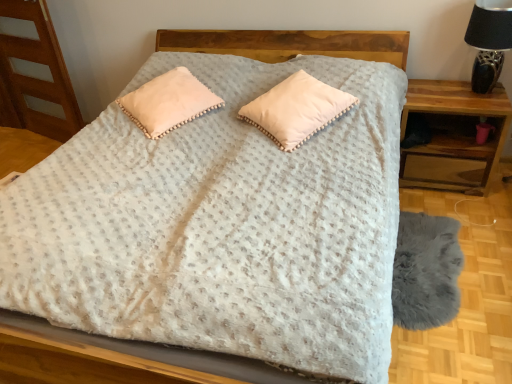
Question: Should I look upward or downward to see pom-pom trim pillow at center, arranged as the second pillow when viewed from the left?

Choices:
 (A) up
 (B) down

Answer: (A)

Question: Which direction should I rotate to look at peach velvety pillow at center, positioned as the 1th pillow in left-to-right order, — up or down?

Choices:
 (A) up
 (B) down

Answer: (A)

Question: From the image's perspective, does black ceramic table lamp at upper right appear lower than pom-pom trim pillow at center, acting as the first pillow starting from the right?

Choices:
 (A) no
 (B) yes

Answer: (A)

Question: Does black ceramic table lamp at upper right come behind pom-pom trim pillow at center, arranged as the second pillow when viewed from the left?

Choices:
 (A) no
 (B) yes

Answer: (B)

Question: Is black ceramic table lamp at upper right wider than pom-pom trim pillow at center, arranged as the second pillow when viewed from the left?

Choices:
 (A) yes
 (B) no

Answer: (B)

Question: Does black ceramic table lamp at upper right have a smaller size compared to pom-pom trim pillow at center, acting as the first pillow starting from the right?

Choices:
 (A) no
 (B) yes

Answer: (B)

Question: Is black ceramic table lamp at upper right positioned in front of pom-pom trim pillow at center, acting as the first pillow starting from the right?

Choices:
 (A) yes
 (B) no

Answer: (B)

Question: Are black ceramic table lamp at upper right and pom-pom trim pillow at center, acting as the first pillow starting from the right, far apart?

Choices:
 (A) no
 (B) yes

Answer: (A)

Question: Is wooden nightstand at right facing towards pom-pom trim pillow at center, acting as the first pillow starting from the right?

Choices:
 (A) yes
 (B) no

Answer: (B)

Question: Is wooden nightstand at right far from pom-pom trim pillow at center, acting as the first pillow starting from the right?

Choices:
 (A) yes
 (B) no

Answer: (B)

Question: Would you say pom-pom trim pillow at center, acting as the first pillow starting from the right, is part of wooden nightstand at right's contents?

Choices:
 (A) no
 (B) yes

Answer: (A)

Question: From the image's perspective, is wooden nightstand at right located above pom-pom trim pillow at center, acting as the first pillow starting from the right?

Choices:
 (A) no
 (B) yes

Answer: (A)

Question: Considering the relative sizes of wooden nightstand at right and pom-pom trim pillow at center, arranged as the second pillow when viewed from the left, in the image provided, is wooden nightstand at right wider than pom-pom trim pillow at center, arranged as the second pillow when viewed from the left,?

Choices:
 (A) no
 (B) yes

Answer: (A)

Question: From a real-world perspective, is wooden nightstand at right physically below pom-pom trim pillow at center, acting as the first pillow starting from the right?

Choices:
 (A) no
 (B) yes

Answer: (B)

Question: Can you confirm if wooden nightstand at right is thinner than peach velvety pillow at center, positioned as the 1th pillow in left-to-right order?

Choices:
 (A) no
 (B) yes

Answer: (B)